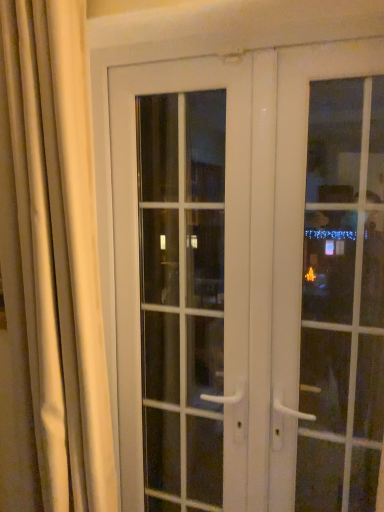
Where is `white glass door at center, acting as the first door starting from the left`? This screenshot has height=512, width=384. white glass door at center, acting as the first door starting from the left is located at coordinates (183, 279).

Describe the element at coordinates (230, 253) in the screenshot. This screenshot has width=384, height=512. I see `white glossy door at center, the second door in the right-to-left sequence` at that location.

The width and height of the screenshot is (384, 512). I want to click on silky beige curtain at left, so click(x=54, y=252).

Would you consider white glossy door at center, the second door in the right-to-left sequence, to be distant from white glass door at center, acting as the first door starting from the left?

No, white glossy door at center, the second door in the right-to-left sequence, is not far away from white glass door at center, acting as the first door starting from the left.

Who is more distant, white glossy door at center, which is counted as the second door, starting from the left, or white glass door at center, acting as the first door starting from the left?

white glass door at center, acting as the first door starting from the left, is further away from the camera.

From the image's perspective, which one is positioned higher, white glossy door at center, which is counted as the second door, starting from the left, or white glass door at center, which is counted as the 3th door, starting from the right?

white glossy door at center, which is counted as the second door, starting from the left, appears higher in the image.

Based on the photo, is white glossy door at center, the second door in the right-to-left sequence, oriented towards white glass door at center, which is counted as the 3th door, starting from the right?

Yes, white glossy door at center, the second door in the right-to-left sequence, is oriented towards white glass door at center, which is counted as the 3th door, starting from the right.

Do you think white glass door at center, which is counted as the 3th door, starting from the right, is within silky beige curtain at left, or outside of it?

white glass door at center, which is counted as the 3th door, starting from the right, cannot be found inside silky beige curtain at left.

Could you tell me if white glass door at center, acting as the first door starting from the left, is facing silky beige curtain at left?

Yes, white glass door at center, acting as the first door starting from the left, is facing silky beige curtain at left.

Is white glass door at center, acting as the first door starting from the left, placed right next to silky beige curtain at left?

No, white glass door at center, acting as the first door starting from the left, is not beside silky beige curtain at left.

From a real-world perspective, which object rests below the other?

From a 3D spatial view, white glass door at center, acting as the first door starting from the left, is below.

Considering the points (178, 387) and (283, 180), which point is in front, point (178, 387) or point (283, 180)?

Positioned in front is point (283, 180).

How different are the orientations of white glass door at center, which is counted as the 3th door, starting from the right, and white glossy door at center, which is counted as the second door, starting from the left, in degrees?

0.463 degrees.

Choose the correct answer: Is white glass door at center, acting as the first door starting from the left, inside white glossy door at center, which is counted as the second door, starting from the left, or outside it?

white glass door at center, acting as the first door starting from the left, is located inside white glossy door at center, which is counted as the second door, starting from the left.

Is the position of white glossy door at right, placed as the third door when sorted from left to right, more distant than that of white glossy door at center, which is counted as the second door, starting from the left?

No.

From the picture: Which is closer, (367, 56) or (156, 65)?

The point (367, 56) is in front.

From a real-world perspective, is white glossy door at right, which is the first door in right-to-left order, located higher than white glossy door at center, the second door in the right-to-left sequence?

Yes, from a real-world perspective, white glossy door at right, which is the first door in right-to-left order, is above white glossy door at center, the second door in the right-to-left sequence.

Is white glossy door at right, which is the first door in right-to-left order, oriented towards white glossy door at center, which is counted as the second door, starting from the left?

Yes, white glossy door at right, which is the first door in right-to-left order, is turned towards white glossy door at center, which is counted as the second door, starting from the left.

From the image's perspective, is white glossy door at right, placed as the third door when sorted from left to right, beneath silky beige curtain at left?

Yes, from the image's perspective, white glossy door at right, placed as the third door when sorted from left to right, is below silky beige curtain at left.

Would you say white glossy door at right, which is the first door in right-to-left order, is inside or outside silky beige curtain at left?

white glossy door at right, which is the first door in right-to-left order, is not inside silky beige curtain at left, it's outside.

Considering the sizes of white glossy door at right, which is the first door in right-to-left order, and silky beige curtain at left in the image, is white glossy door at right, which is the first door in right-to-left order, taller or shorter than silky beige curtain at left?

Clearly, white glossy door at right, which is the first door in right-to-left order, is shorter compared to silky beige curtain at left.

Does silky beige curtain at left lie in front of white glossy door at center, the second door in the right-to-left sequence?

Yes, silky beige curtain at left is closer to the viewer.

Which is closer, (39, 279) or (295, 253)?

Point (39, 279) is closer to the camera than point (295, 253).

Between silky beige curtain at left and white glossy door at center, the second door in the right-to-left sequence, which one has less height?

With less height is silky beige curtain at left.

Is silky beige curtain at left with white glossy door at center, which is counted as the second door, starting from the left?

No, silky beige curtain at left is not in contact with white glossy door at center, which is counted as the second door, starting from the left.

Consider the image. Is white glass door at center, acting as the first door starting from the left, far from white glossy door at right, placed as the third door when sorted from left to right?

No, white glass door at center, acting as the first door starting from the left, is not far from white glossy door at right, placed as the third door when sorted from left to right.

Can you confirm if white glass door at center, acting as the first door starting from the left, is taller than white glossy door at right, placed as the third door when sorted from left to right?

Indeed, white glass door at center, acting as the first door starting from the left, has a greater height compared to white glossy door at right, placed as the third door when sorted from left to right.

From a real-world perspective, is white glass door at center, which is counted as the 3th door, starting from the right, over white glossy door at right, placed as the third door when sorted from left to right?

No, from a real-world perspective, white glass door at center, which is counted as the 3th door, starting from the right, is not over white glossy door at right, placed as the third door when sorted from left to right

The width and height of the screenshot is (384, 512). What are the coordinates of `door that appears below the white glossy door at center, which is counted as the second door, starting from the left (from a real-world perspective)` in the screenshot? It's located at (183, 279).

Locate an element on the screen. Image resolution: width=384 pixels, height=512 pixels. curtain in front of the white glass door at center, which is counted as the 3th door, starting from the right is located at coordinates (54, 252).

Estimate the real-world distances between objects in this image. Which object is closer to white glossy door at right, which is the first door in right-to-left order, white glass door at center, which is counted as the 3th door, starting from the right, or white glossy door at center, which is counted as the second door, starting from the left?

white glossy door at center, which is counted as the second door, starting from the left, is positioned closer to the anchor white glossy door at right, which is the first door in right-to-left order.

When comparing their distances from white glossy door at right, placed as the third door when sorted from left to right, does silky beige curtain at left or white glass door at center, which is counted as the 3th door, starting from the right, seem closer?

white glass door at center, which is counted as the 3th door, starting from the right, is positioned closer to the anchor white glossy door at right, placed as the third door when sorted from left to right.

Consider the image. Looking at the image, which one is located closer to silky beige curtain at left, white glossy door at center, the second door in the right-to-left sequence, or white glass door at center, which is counted as the 3th door, starting from the right?

white glossy door at center, the second door in the right-to-left sequence, is positioned closer to the anchor silky beige curtain at left.

Estimate the real-world distances between objects in this image. Which object is closer to silky beige curtain at left, white glass door at center, which is counted as the 3th door, starting from the right, or white glossy door at center, the second door in the right-to-left sequence?

The object closer to silky beige curtain at left is white glossy door at center, the second door in the right-to-left sequence.

Based on the photo, which object lies nearer to the anchor point white glass door at center, acting as the first door starting from the left, silky beige curtain at left or white glossy door at center, the second door in the right-to-left sequence?

white glossy door at center, the second door in the right-to-left sequence, is closer to white glass door at center, acting as the first door starting from the left.

From the image, which object appears to be farther from silky beige curtain at left, white glossy door at center, the second door in the right-to-left sequence, or white glossy door at right, placed as the third door when sorted from left to right?

white glossy door at right, placed as the third door when sorted from left to right.

Estimate the real-world distances between objects in this image. Which object is closer to white glossy door at right, which is the first door in right-to-left order, white glossy door at center, which is counted as the second door, starting from the left, or white glass door at center, acting as the first door starting from the left?

Among the two, white glossy door at center, which is counted as the second door, starting from the left, is located nearer to white glossy door at right, which is the first door in right-to-left order.

From the picture: From the image, which object appears to be farther from white glass door at center, acting as the first door starting from the left, white glossy door at center, the second door in the right-to-left sequence, or white glossy door at right, placed as the third door when sorted from left to right?

white glossy door at right, placed as the third door when sorted from left to right, is positioned further to the anchor white glass door at center, acting as the first door starting from the left.

Where is `door between silky beige curtain at left and white glossy door at center, which is counted as the second door, starting from the left`? door between silky beige curtain at left and white glossy door at center, which is counted as the second door, starting from the left is located at coordinates (183, 279).

Identify the location of door situated between white glass door at center, acting as the first door starting from the left, and white glossy door at right, placed as the third door when sorted from left to right, from left to right. This screenshot has height=512, width=384. (230, 253).